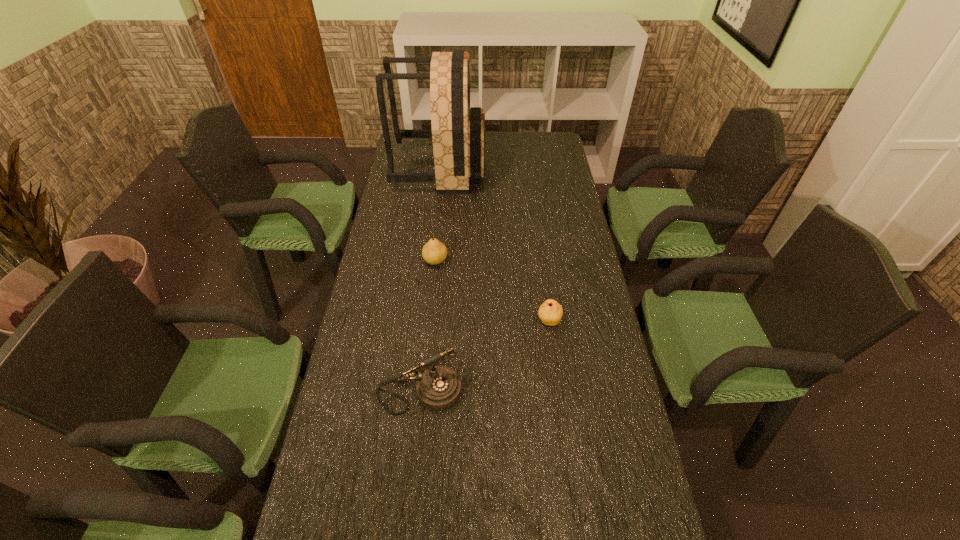
At what (x,y) coordinates should I click in order to perform the action: click on vacant area located on the left of the nearer pear. Please return your answer as a coordinate pair (x, y). Image resolution: width=960 pixels, height=540 pixels. Looking at the image, I should click on (460, 321).

Identify the location of object at the far edge. This screenshot has height=540, width=960. (458, 133).

Where is `backpack situated at the left edge`? The height and width of the screenshot is (540, 960). backpack situated at the left edge is located at coordinates [458, 133].

The width and height of the screenshot is (960, 540). In order to click on telephone situated at the left edge in this screenshot , I will do `click(438, 388)`.

Image resolution: width=960 pixels, height=540 pixels. Find the location of `object that is at the right edge`. object that is at the right edge is located at coordinates (550, 312).

The width and height of the screenshot is (960, 540). I want to click on object that is positioned at the far left corner, so click(458, 133).

At what (x,y) coordinates should I click in order to perform the action: click on free space at the left edge of the desktop. Please return your answer as a coordinate pair (x, y). Looking at the image, I should click on (358, 518).

Where is `vacant area at the right edge of the desktop`? vacant area at the right edge of the desktop is located at coordinates (606, 463).

Where is `vacant space at the far right corner of the desktop`? vacant space at the far right corner of the desktop is located at coordinates (558, 146).

Where is `free space between the tallest object and the shortest object`? free space between the tallest object and the shortest object is located at coordinates (494, 245).